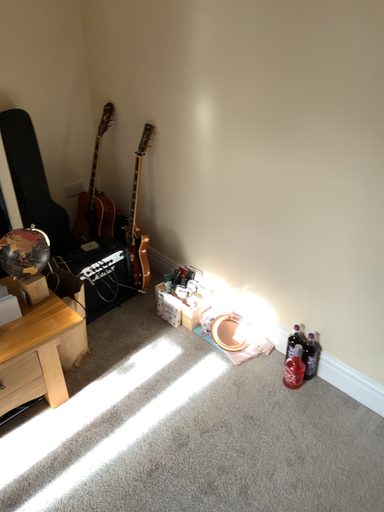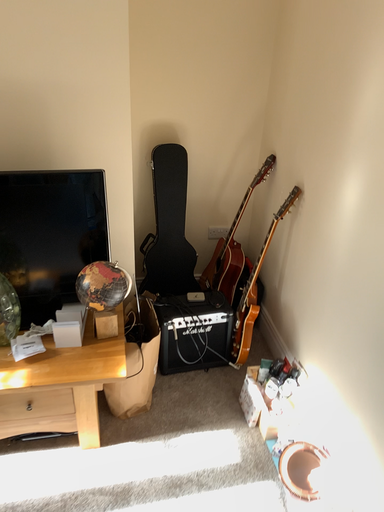
Question: How did the camera likely rotate when shooting the video?

Choices:
 (A) rotated upward
 (B) rotated downward

Answer: (A)